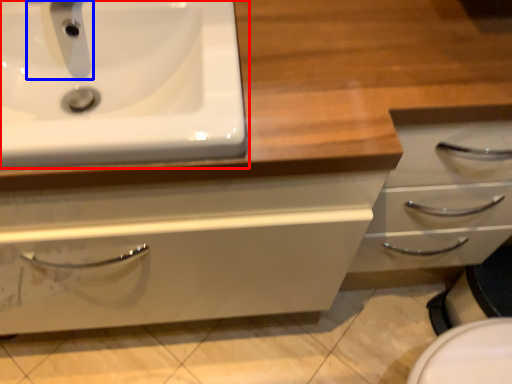
Question: Which object is closer to the camera taking this photo, sink (highlighted by a red box) or plumbing fixture (highlighted by a blue box)?

Choices:
 (A) sink
 (B) plumbing fixture

Answer: (A)